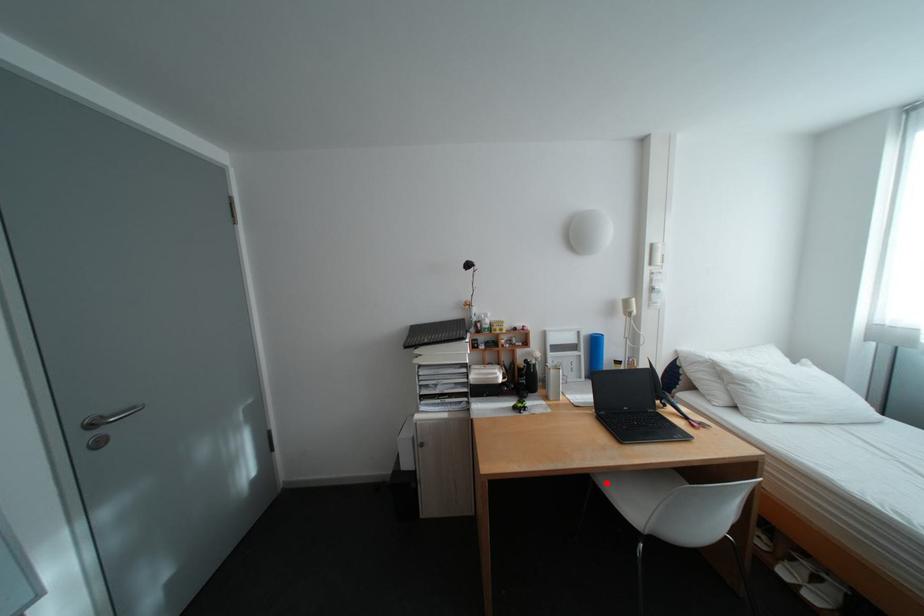
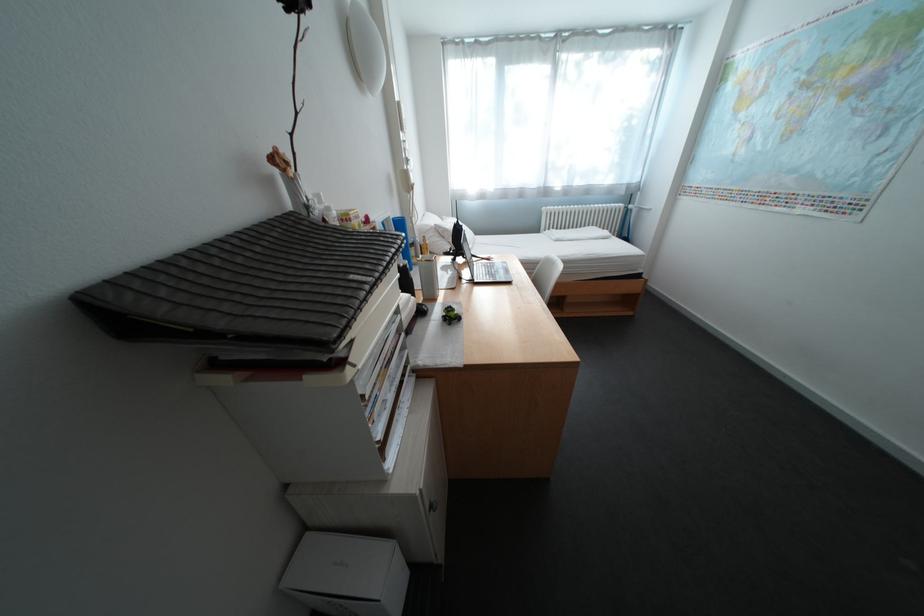
Question: I am providing you with two images of the same scene from different viewpoints. A red point is marked on the first image. Is the red point's position out of view in image 2?

Choices:
 (A) Yes
 (B) No

Answer: (A)